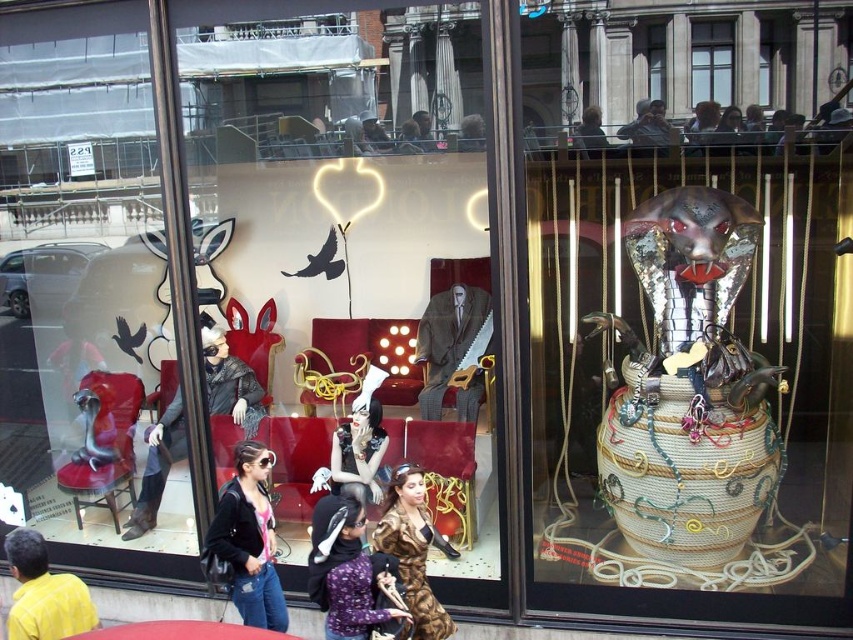
Is denim jacket at lower left bigger than yellow shirt at lower left?

Indeed, denim jacket at lower left has a larger size compared to yellow shirt at lower left.

The height and width of the screenshot is (640, 853). What do you see at coordinates (247, 540) in the screenshot?
I see `denim jacket at lower left` at bounding box center [247, 540].

Is point (258, 513) closer to viewer compared to point (9, 540)?

No.

The width and height of the screenshot is (853, 640). I want to click on denim jacket at lower left, so click(x=247, y=540).

Is point (38, 596) less distant than point (693, 81)?

That is True.

Between point (44, 595) and point (730, 45), which one is positioned in front?

Point (44, 595)

You are a GUI agent. You are given a task and a screenshot of the screen. Output one action in this format:
    pyautogui.click(x=<x>, y=<y>)
    Task: Click on the yellow shirt at lower left
    The height and width of the screenshot is (640, 853).
    Given the screenshot: What is the action you would take?
    pyautogui.click(x=44, y=593)

Locate an element on the screen. yellow shirt at lower left is located at coordinates (44, 593).

Between printed silk blouse at center and yellow shirt at lower left, which one has more height?

With more height is printed silk blouse at center.

Does printed silk blouse at center have a lesser height compared to yellow shirt at lower left?

Incorrect, printed silk blouse at center's height does not fall short of yellow shirt at lower left's.

The image size is (853, 640). Find the location of `printed silk blouse at center`. printed silk blouse at center is located at coordinates (347, 572).

Where is `printed silk blouse at center`? Image resolution: width=853 pixels, height=640 pixels. printed silk blouse at center is located at coordinates (347, 572).